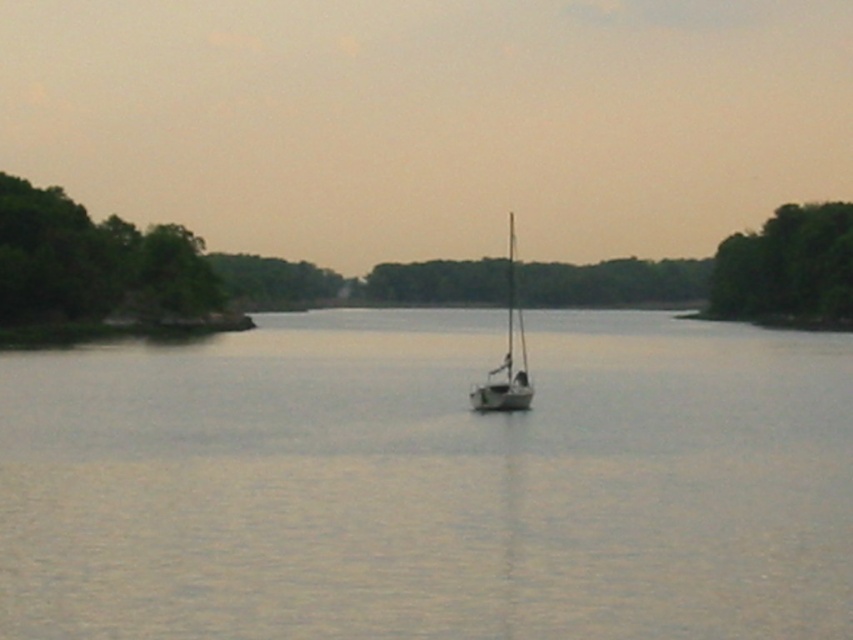
Based on the photo, you are an observer standing at the front of the sailboat in the center of the waterway. You notice green leafy trees at left and green leafy trees at right. Which group of trees appears taller from your vantage point?

The green leafy trees at right appear taller because they have a greater height compared to the green leafy trees at left.